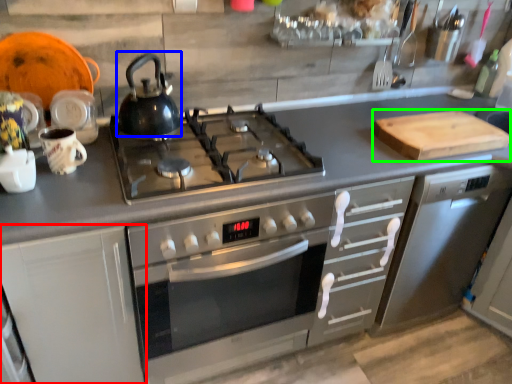
Question: Which object is positioned closest to cabinetry (highlighted by a red box)? Select from kettle (highlighted by a blue box) and cutting board (highlighted by a green box).

Choices:
 (A) kettle
 (B) cutting board

Answer: (A)